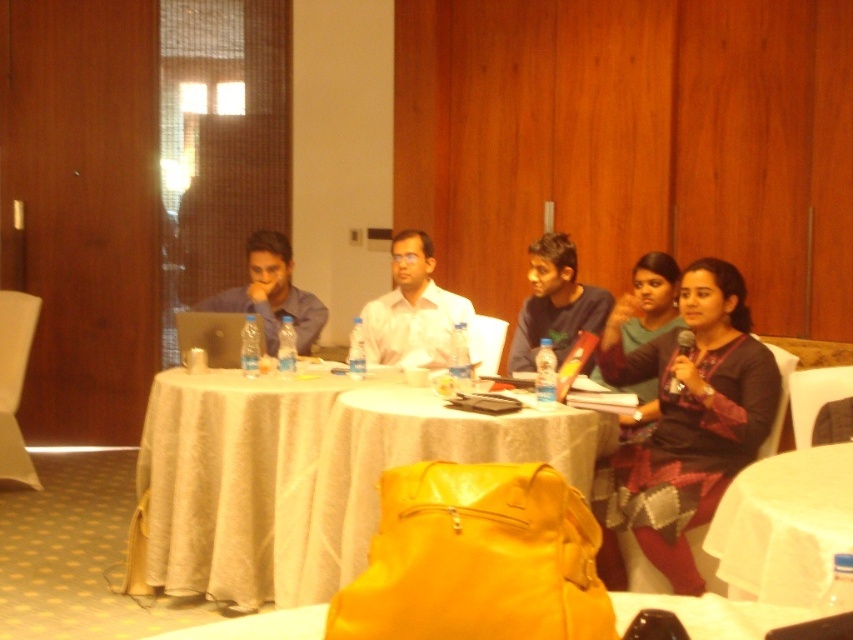
Does white fabric tablecloth at center appear on the left side of yellow fabric table at center?

Yes, white fabric tablecloth at center is to the left of yellow fabric table at center.

Between point (375, 381) and point (328, 589), which one is positioned behind?

The point (375, 381) is more distant.

Is point (376, 381) positioned before point (579, 468)?

That is False.

In order to click on white fabric tablecloth at center in this screenshot , I will do `click(233, 481)`.

Does point (737, 513) come closer to viewer compared to point (370, 328)?

Yes.

Which is behind, point (811, 592) or point (409, 352)?

Positioned behind is point (409, 352).

You are a GUI agent. You are given a task and a screenshot of the screen. Output one action in this format:
    pyautogui.click(x=<x>, y=<y>)
    Task: Click on the white cloth table at center
    
    Given the screenshot: What is the action you would take?
    pyautogui.click(x=784, y=525)

The height and width of the screenshot is (640, 853). What do you see at coordinates (412, 310) in the screenshot? I see `white glossy shirt at center` at bounding box center [412, 310].

Does white glossy shirt at center have a smaller size compared to matte blue shirt at left?

Correct, white glossy shirt at center occupies less space than matte blue shirt at left.

Locate an element on the screen. The height and width of the screenshot is (640, 853). white glossy shirt at center is located at coordinates (412, 310).

Find the location of `white glossy shirt at center`. white glossy shirt at center is located at coordinates (412, 310).